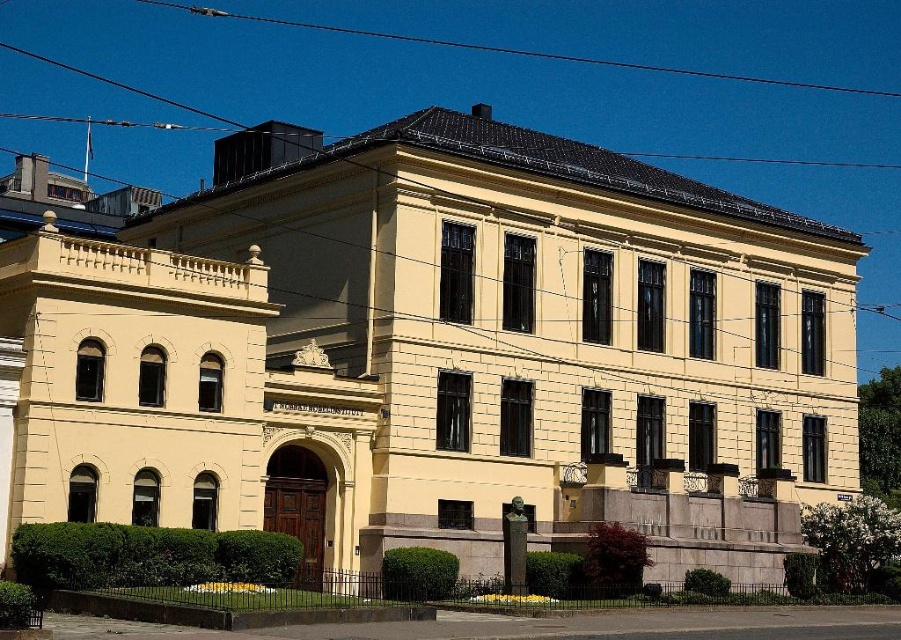
You are standing in front of the classical building and notice the black wire at upper center and the bronze statue at center. Which object is positioned higher in the image?

The black wire at upper center is located above the bronze statue at center, so it is positioned higher.

You are an architect reviewing the building plans. You notice the black wire at upper center and the bronze statue at center. Which object is taller according to the design specifications?

The black wire at upper center is taller than the bronze statue at center according to the design specifications.